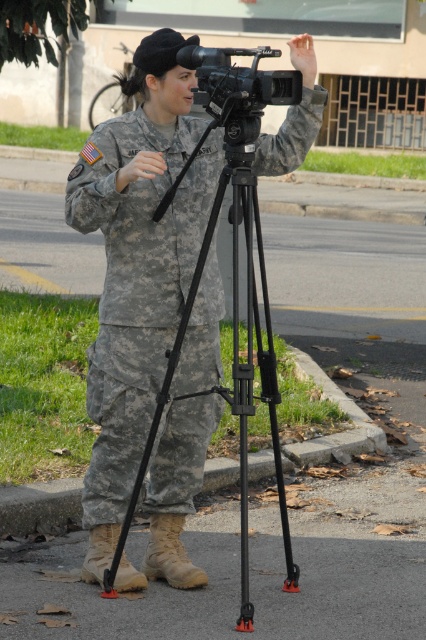
You are standing at the point marked as point (x=137, y=438) in the image. A person in a military uniform is standing 4.57 meters away from you. Can you estimate how far you are from the person?

The distance between you and the person in the military uniform is exactly 4.57 meters, as stated in the description.

You are a photographer trying to set up your equipment. You have a black matte tripod at center and a black matte camera at center. According to the scene, where should you place the camera relative to the tripod?

The black matte tripod at center is to the left of the black matte camera at center, so you should place the camera to the right of the tripod.

You are a photographer trying to set up a shot. You have a camouflage fabric uniform at center and a black matte tripod at center in your viewfinder. Which object is shorter in height?

The camouflage fabric uniform at center is shorter than the black matte tripod at center.